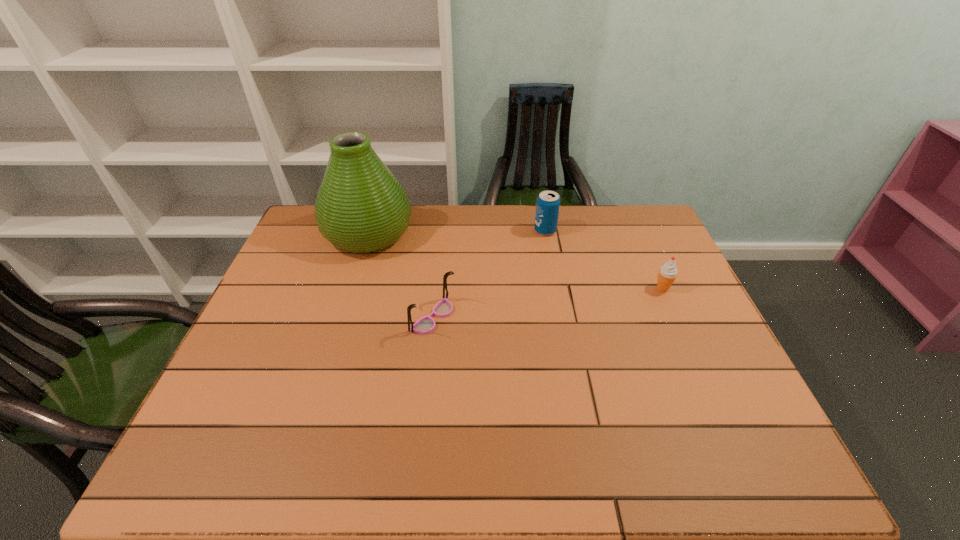
The image size is (960, 540). Identify the location of vacant region located on the left of the rightmost object. (606, 288).

Where is `vase located at the far edge`? The width and height of the screenshot is (960, 540). vase located at the far edge is located at coordinates (361, 207).

Find the location of a particular element. soda can present at the far edge is located at coordinates (548, 202).

I want to click on object at the left edge, so click(x=361, y=207).

The width and height of the screenshot is (960, 540). I want to click on object located in the right edge section of the desktop, so click(x=667, y=273).

Identify the location of object at the far left corner. This screenshot has width=960, height=540. (361, 207).

Image resolution: width=960 pixels, height=540 pixels. Find the location of `blank space at the far edge`. blank space at the far edge is located at coordinates (521, 217).

The height and width of the screenshot is (540, 960). What are the coordinates of `free space at the near edge of the desktop` in the screenshot? It's located at (294, 455).

The width and height of the screenshot is (960, 540). I want to click on vacant space at the left edge, so click(x=285, y=288).

What are the coordinates of `vacant position at the right edge of the desktop` in the screenshot? It's located at (708, 317).